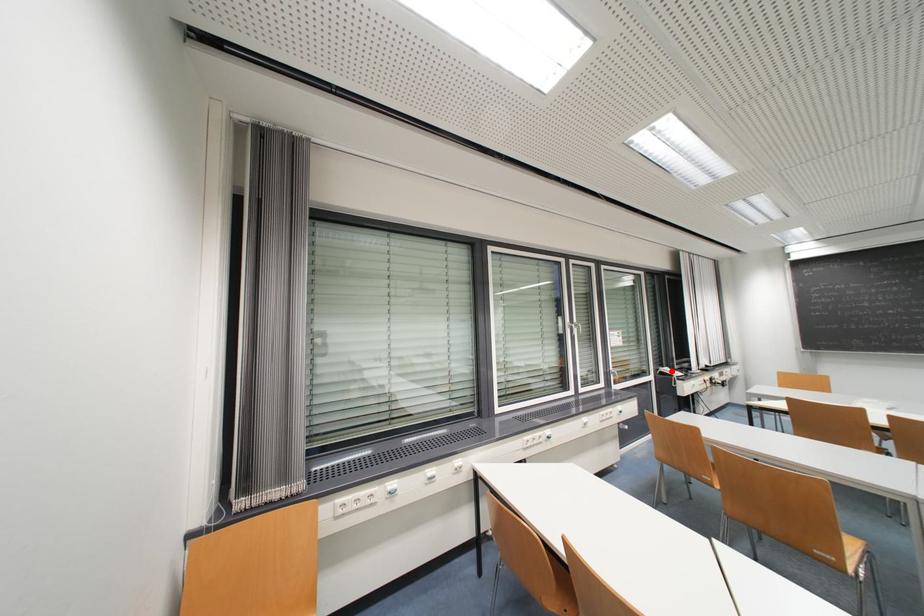
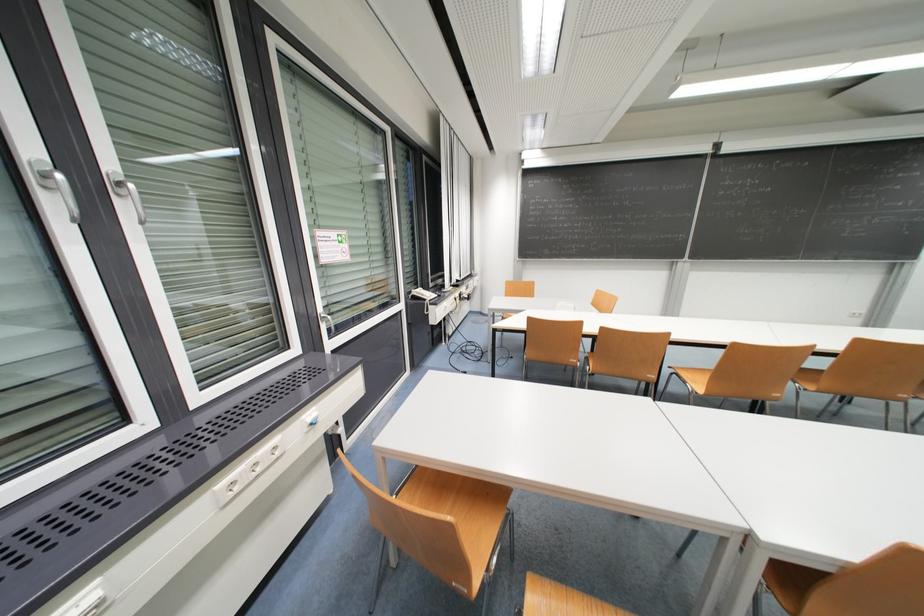
The point at the highlighted location is marked in the first image. Where is the corresponding point in the second image?

(426, 293)